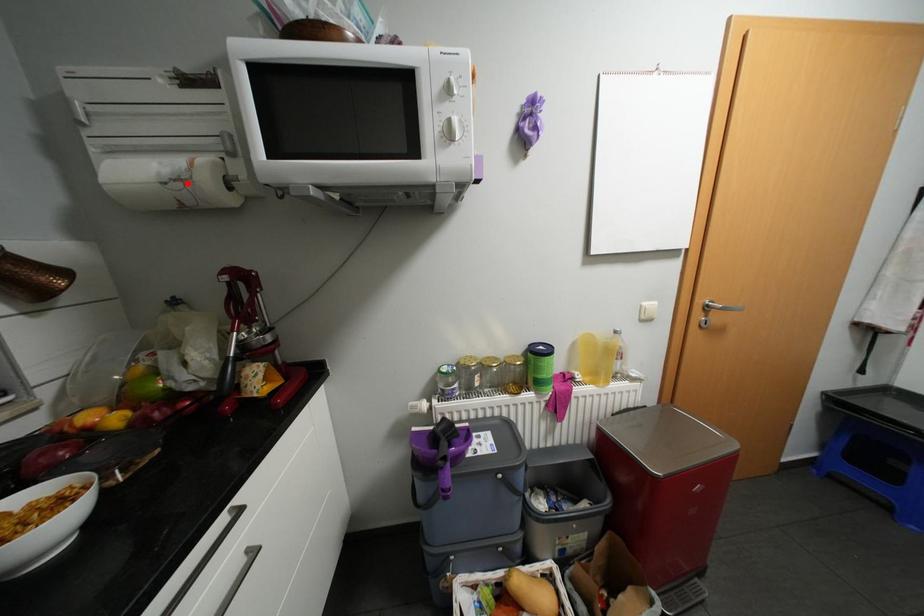
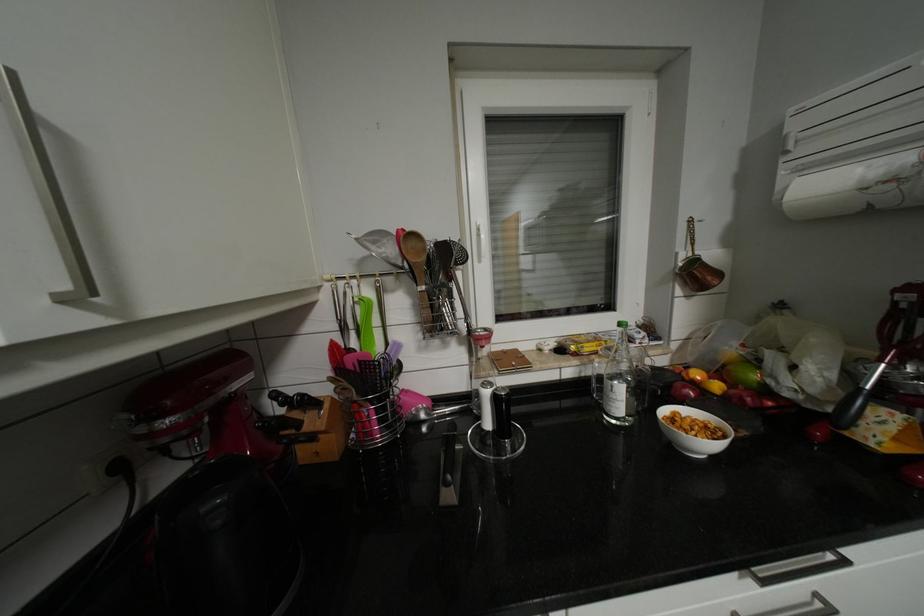
Where in the second image is the point corresponding to the highlighted location from the first image?

(898, 185)